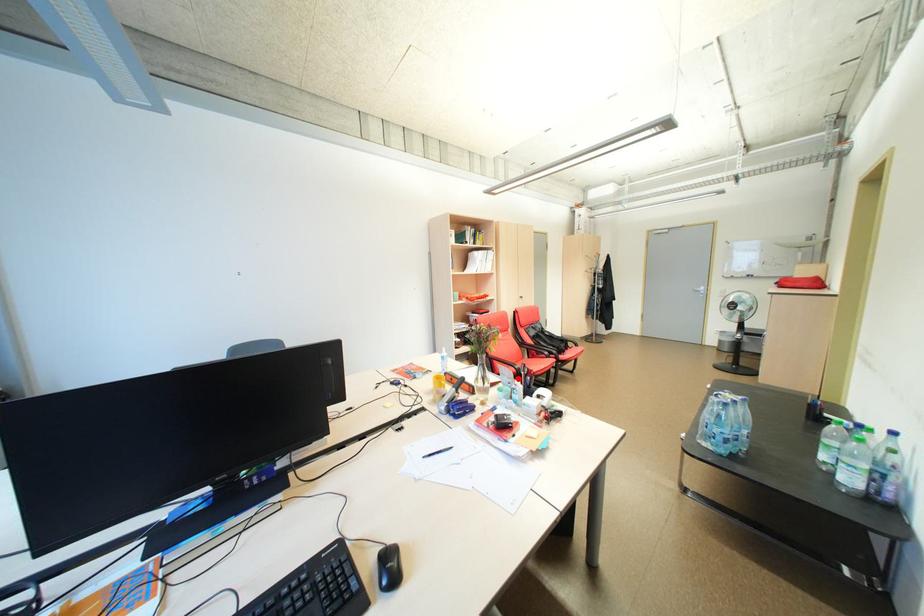
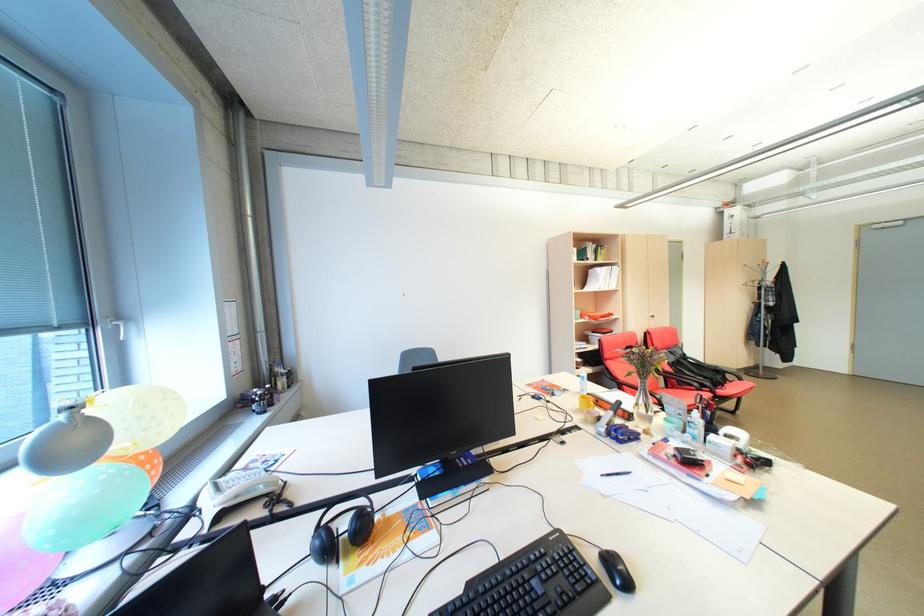
Locate, in the second image, the point that corresponds to the highlighted location in the first image.

(688, 410)